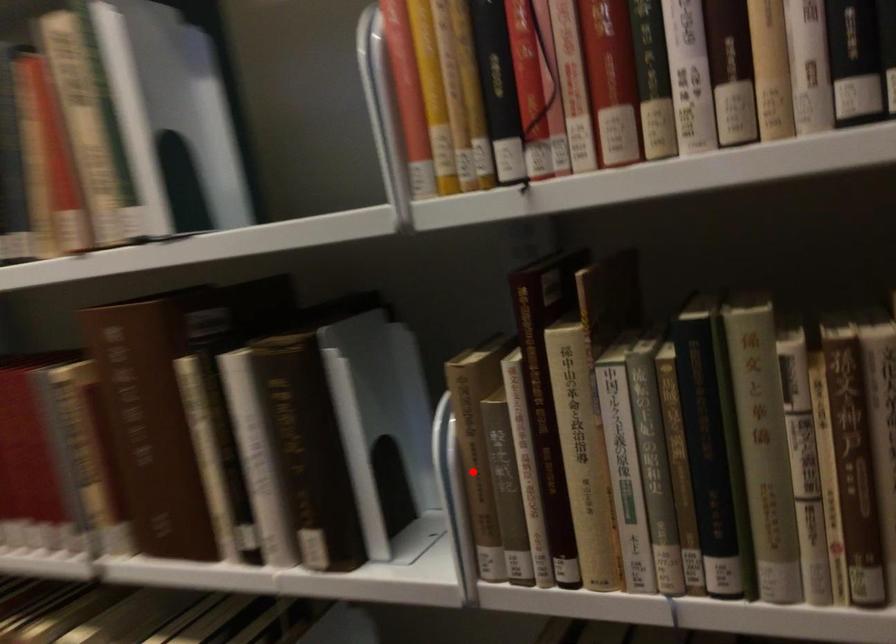
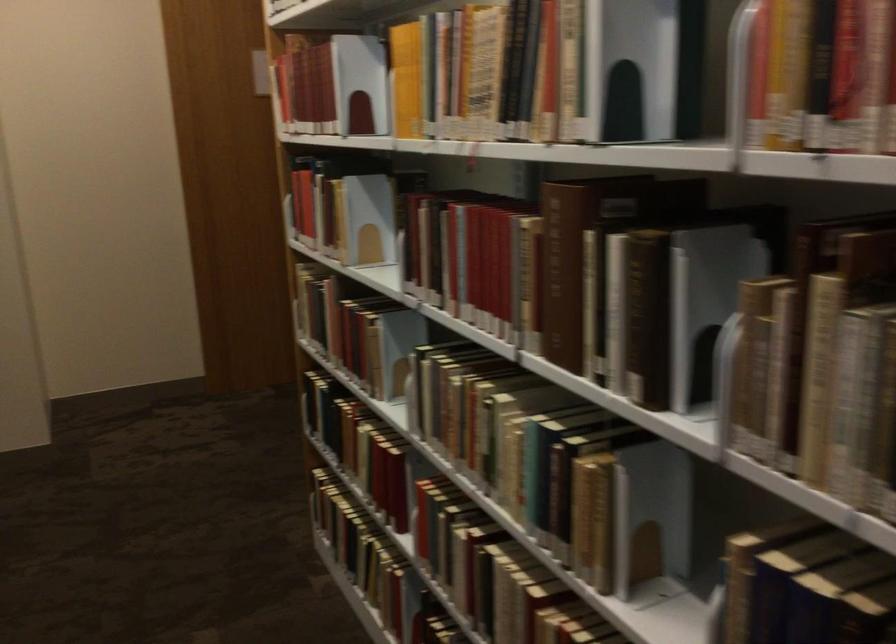
In the second image, find the point that corresponds to the highlighted location in the first image.

(743, 363)